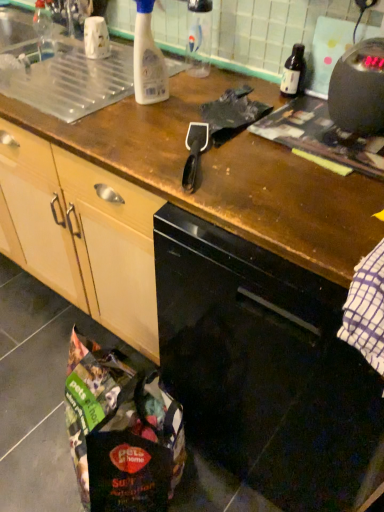
Where is `vacant space to the right of black plastic spatula at center`? The height and width of the screenshot is (512, 384). vacant space to the right of black plastic spatula at center is located at coordinates (259, 165).